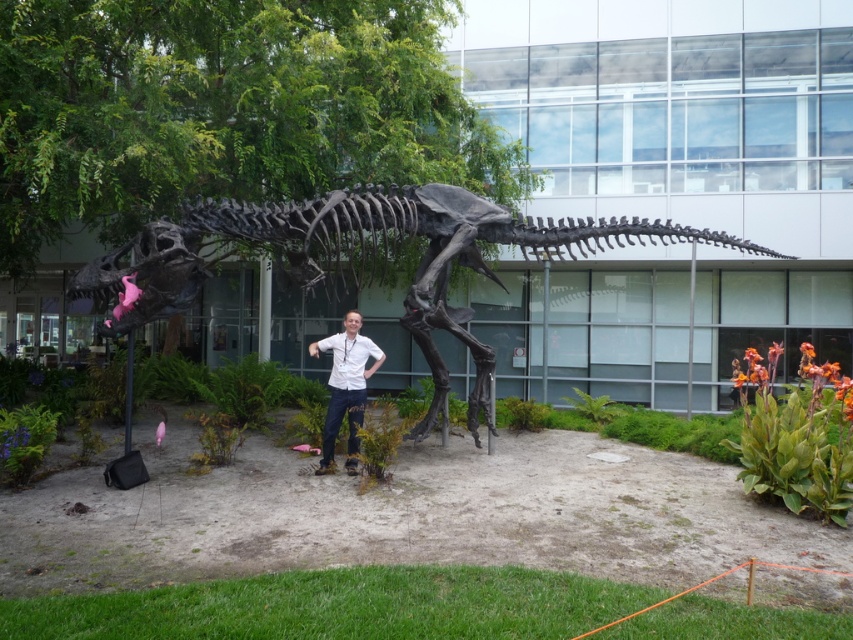
Question: Is shiny metallic dinosaur skeleton at center smaller than white matte shirt at center?

Choices:
 (A) no
 (B) yes

Answer: (B)

Question: Which point is farther to the camera?

Choices:
 (A) (258, 244)
 (B) (316, 355)

Answer: (A)

Question: Which point is farther to the camera?

Choices:
 (A) (527, 243)
 (B) (349, 449)

Answer: (A)

Question: Which of the following is the farthest from the observer?

Choices:
 (A) shiny metallic dinosaur skeleton at center
 (B) white matte shirt at center

Answer: (A)

Question: Can you confirm if shiny metallic dinosaur skeleton at center is bigger than white matte shirt at center?

Choices:
 (A) yes
 (B) no

Answer: (B)

Question: Can you confirm if shiny metallic dinosaur skeleton at center is bigger than white matte shirt at center?

Choices:
 (A) no
 (B) yes

Answer: (A)